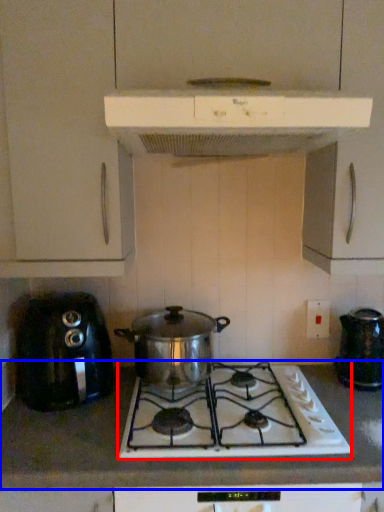
Question: Which point is further to the camera, gas stove (highlighted by a red box) or countertop (highlighted by a blue box)?

Choices:
 (A) gas stove
 (B) countertop

Answer: (A)